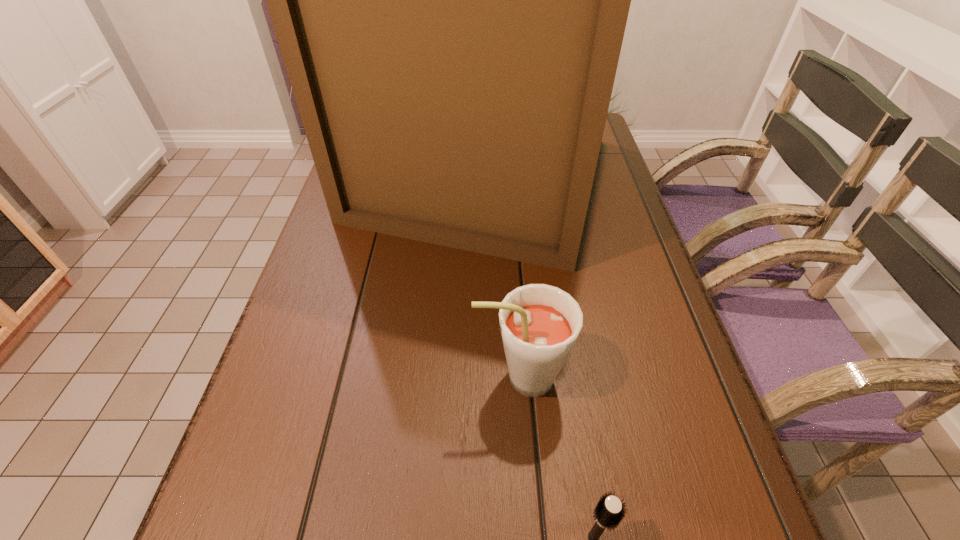
Locate an element on the screen. box is located at coordinates (450, 0).

You are a GUI agent. You are given a task and a screenshot of the screen. Output one action in this format:
    pyautogui.click(x=<x>, y=<y>)
    Task: Click on the tallest object
    
    Given the screenshot: What is the action you would take?
    pyautogui.click(x=450, y=0)

The height and width of the screenshot is (540, 960). In order to click on root beer in this screenshot , I will do `click(539, 324)`.

The width and height of the screenshot is (960, 540). I want to click on the second farthest object, so click(539, 324).

You are a GUI agent. You are given a task and a screenshot of the screen. Output one action in this format:
    pyautogui.click(x=<x>, y=<y>)
    Task: Click on the vacant space located on the front of the farthest object
    Image resolution: width=960 pixels, height=540 pixels.
    Given the screenshot: What is the action you would take?
    pyautogui.click(x=484, y=388)

The image size is (960, 540). I want to click on free location located on the drink side of the root beer, so click(359, 377).

You are a GUI agent. You are given a task and a screenshot of the screen. Output one action in this format:
    pyautogui.click(x=<x>, y=<y>)
    Task: Click on the vacant area located on the drink side of the root beer
    This screenshot has height=540, width=960.
    Given the screenshot: What is the action you would take?
    pyautogui.click(x=417, y=377)

The image size is (960, 540). I want to click on vacant space situated 0.120m on the drink side of the root beer, so click(x=405, y=377).

I want to click on object that is positioned at the far edge, so click(x=450, y=0).

I want to click on object at the left edge, so click(450, 0).